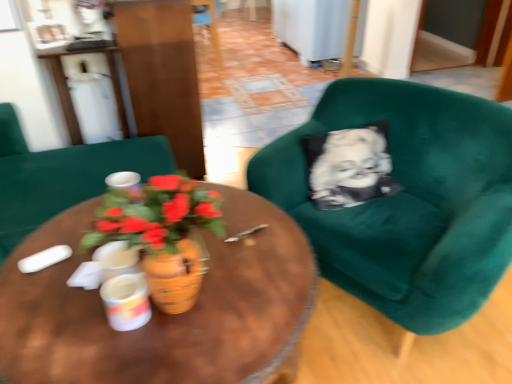
At what (x,y) coordinates should I click in order to perform the action: click on vacant space situated on the left part of terracotta pot at center. Please return your answer as a coordinate pair (x, y). This screenshot has width=512, height=384. Looking at the image, I should click on (59, 317).